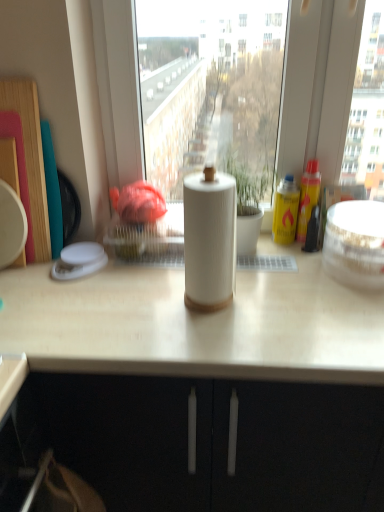
Question: Is white plastic container at left, the first appliance viewed from the left, a part of white glossy bowl at right, placed as the 1th appliance when sorted from right to left?

Choices:
 (A) no
 (B) yes

Answer: (A)

Question: Is white glossy bowl at right, which is the 2th appliance from left to right, looking in the opposite direction of white plastic container at left, the first appliance viewed from the left?

Choices:
 (A) yes
 (B) no

Answer: (B)

Question: Are white glossy bowl at right, placed as the 1th appliance when sorted from right to left, and white plastic container at left, the first appliance viewed from the left, making contact?

Choices:
 (A) no
 (B) yes

Answer: (A)

Question: Does white glossy bowl at right, which is the 2th appliance from left to right, have a lesser height compared to white plastic container at left, the first appliance viewed from the left?

Choices:
 (A) no
 (B) yes

Answer: (A)

Question: Is white glossy bowl at right, which is the 2th appliance from left to right, thinner than white plastic container at left, the 2th appliance in the right-to-left sequence?

Choices:
 (A) no
 (B) yes

Answer: (A)

Question: Does white glossy bowl at right, placed as the 1th appliance when sorted from right to left, appear on the right side of white plastic container at left, the 2th appliance in the right-to-left sequence?

Choices:
 (A) yes
 (B) no

Answer: (A)

Question: Is white matte paper towel holder at center far from white matte paper towel at center?

Choices:
 (A) no
 (B) yes

Answer: (A)

Question: Does white matte paper towel holder at center have a greater height compared to white matte paper towel at center?

Choices:
 (A) no
 (B) yes

Answer: (B)

Question: Can you confirm if white matte paper towel holder at center is bigger than white matte paper towel at center?

Choices:
 (A) no
 (B) yes

Answer: (B)

Question: Does white matte paper towel holder at center have a lesser width compared to white matte paper towel at center?

Choices:
 (A) yes
 (B) no

Answer: (B)

Question: From a real-world perspective, is white matte paper towel holder at center under white matte paper towel at center?

Choices:
 (A) no
 (B) yes

Answer: (B)

Question: Does white matte paper towel holder at center have a greater width compared to white matte paper towel at center?

Choices:
 (A) yes
 (B) no

Answer: (A)

Question: Does white glossy bowl at right, placed as the 1th appliance when sorted from right to left, come behind white matte paper towel holder at center?

Choices:
 (A) yes
 (B) no

Answer: (A)